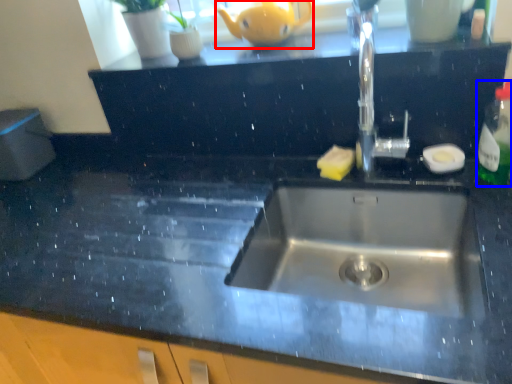
Question: Among these objects, which one is nearest to the camera, tea pot (highlighted by a red box) or bottle (highlighted by a blue box)?

Choices:
 (A) tea pot
 (B) bottle

Answer: (B)